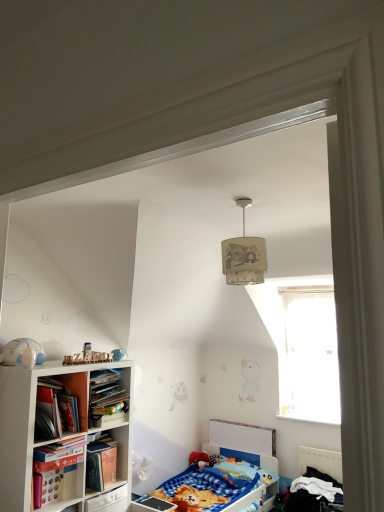
This screenshot has width=384, height=512. I want to click on hardcover book at lower left, positioned as the 2th book in top-to-bottom order, so click(x=57, y=470).

What is the approximate width of blue cotton bed at lower right, placed as the second bed when sorted from left to right?

It is 42.70 centimeters.

What do you see at coordinates (321, 461) in the screenshot? Image resolution: width=384 pixels, height=512 pixels. I see `blue cotton bed at lower right, placed as the second bed when sorted from left to right` at bounding box center [321, 461].

In order to face transparent glass window at upper right, should I rotate leftwards or rightwards?

Turn right approximately 15.132 degrees to face it.

The image size is (384, 512). What do you see at coordinates (58, 405) in the screenshot? I see `hardcover book at left, the 2th book from the bottom` at bounding box center [58, 405].

What do you see at coordinates (227, 473) in the screenshot? This screenshot has height=512, width=384. I see `blue fabric bed at lower center, which appears as the 2th bed when viewed from the right` at bounding box center [227, 473].

I want to click on beige fabric lampshade at upper center, so click(x=244, y=256).

Looking at the image, does beige fabric lampshade at upper center seem bigger or smaller compared to blue fabric bed at lower center, which appears as the 2th bed when viewed from the right?

Considering their sizes, beige fabric lampshade at upper center takes up less space than blue fabric bed at lower center, which appears as the 2th bed when viewed from the right.

Is beige fabric lampshade at upper center located outside blue fabric bed at lower center, which appears as the 2th bed when viewed from the right?

Indeed, beige fabric lampshade at upper center is completely outside blue fabric bed at lower center, which appears as the 2th bed when viewed from the right.

From a real-world perspective, between beige fabric lampshade at upper center and blue fabric bed at lower center, the 1th bed viewed from the left, who is vertically lower?

blue fabric bed at lower center, the 1th bed viewed from the left, from a real-world perspective.

From a real-world perspective, is white matte bookcase at left above or below transparent glass window at upper right?

Clearly, from a real-world perspective, white matte bookcase at left is below transparent glass window at upper right.

Does white matte bookcase at left contain transparent glass window at upper right?

No, transparent glass window at upper right is located outside of white matte bookcase at left.

Can you confirm if white matte bookcase at left is shorter than transparent glass window at upper right?

Yes.

Between white matte bookcase at left and transparent glass window at upper right, which one appears on the left side from the viewer's perspective?

white matte bookcase at left.

Who is more distant, blue cotton bed at lower right, which is counted as the first bed, starting from the right, or transparent glass window at upper right?

transparent glass window at upper right is further away from the camera.

Is blue cotton bed at lower right, which is counted as the first bed, starting from the right, in contact with transparent glass window at upper right?

No, blue cotton bed at lower right, which is counted as the first bed, starting from the right, is not with transparent glass window at upper right.

Looking at their sizes, would you say blue cotton bed at lower right, which is counted as the first bed, starting from the right, is wider or thinner than transparent glass window at upper right?

Clearly, blue cotton bed at lower right, which is counted as the first bed, starting from the right, has more width compared to transparent glass window at upper right.

Considering the sizes of objects blue fabric bed at lower center, the 1th bed viewed from the left, and hardcover book at left, acting as the first book starting from the top, in the image provided, who is wider, blue fabric bed at lower center, the 1th bed viewed from the left, or hardcover book at left, acting as the first book starting from the top,?

blue fabric bed at lower center, the 1th bed viewed from the left, is wider.

Is blue fabric bed at lower center, the 1th bed viewed from the left, not inside hardcover book at left, acting as the first book starting from the top?

Yes, blue fabric bed at lower center, the 1th bed viewed from the left, is not within hardcover book at left, acting as the first book starting from the top.

Does blue fabric bed at lower center, which appears as the 2th bed when viewed from the right, appear on the right side of hardcover book at left, acting as the first book starting from the top?

Indeed, blue fabric bed at lower center, which appears as the 2th bed when viewed from the right, is positioned on the right side of hardcover book at left, acting as the first book starting from the top.

Consider the image. Is hardcover book at left, the 2th book from the bottom, at the back of blue fabric bed at lower center, which appears as the 2th bed when viewed from the right?

That's not correct — blue fabric bed at lower center, which appears as the 2th bed when viewed from the right, is not looking away from hardcover book at left, the 2th book from the bottom.

Is hardcover book at lower left, positioned as the 2th book in top-to-bottom order, looking in the opposite direction of beige fabric lampshade at upper center?

No.

This screenshot has width=384, height=512. What are the coordinates of `lamp on the right side of hardcover book at lower left, positioned as the 2th book in top-to-bottom order` in the screenshot? It's located at coord(244,256).

Do you think hardcover book at lower left, positioned as the 2th book in top-to-bottom order, is within beige fabric lampshade at upper center, or outside of it?

hardcover book at lower left, positioned as the 2th book in top-to-bottom order, is not enclosed by beige fabric lampshade at upper center.

Is hardcover book at lower left, which is the first book from bottom to top, at the right side of beige fabric lampshade at upper center?

In fact, hardcover book at lower left, which is the first book from bottom to top, is to the left of beige fabric lampshade at upper center.

Considering the relative sizes of beige fabric lampshade at upper center and blue cotton bed at lower right, placed as the second bed when sorted from left to right, in the image provided, is beige fabric lampshade at upper center taller than blue cotton bed at lower right, placed as the second bed when sorted from left to right,?

Indeed, beige fabric lampshade at upper center has a greater height compared to blue cotton bed at lower right, placed as the second bed when sorted from left to right.

Is beige fabric lampshade at upper center oriented towards blue cotton bed at lower right, which is counted as the first bed, starting from the right?

No, beige fabric lampshade at upper center is not facing towards blue cotton bed at lower right, which is counted as the first bed, starting from the right.

Considering the points (245, 237) and (337, 472), which point is behind, point (245, 237) or point (337, 472)?

The point (337, 472) is behind.

From a real-world perspective, is beige fabric lampshade at upper center on blue cotton bed at lower right, which is counted as the first bed, starting from the right?

Yes.

In the scene shown: Does transparent glass window at upper right contain hardcover book at left, the 2th book from the bottom?

No, transparent glass window at upper right does not contain hardcover book at left, the 2th book from the bottom.

In the scene shown: From the image's perspective, is transparent glass window at upper right above hardcover book at left, acting as the first book starting from the top?

No, from the image's perspective, transparent glass window at upper right is not over hardcover book at left, acting as the first book starting from the top.

Which object is more forward, transparent glass window at upper right or hardcover book at left, acting as the first book starting from the top?

hardcover book at left, acting as the first book starting from the top, is more forward.

Locate an element on the screen. lamp on the right of blue fabric bed at lower center, the 1th bed viewed from the left is located at coordinates (244, 256).

Locate an element on the screen. bookcase below the transparent glass window at upper right (from the image's perspective) is located at coordinates (55, 440).

Which object lies further to the anchor point beige fabric lampshade at upper center, blue fabric bed at lower center, the 1th bed viewed from the left, or hardcover book at lower left, positioned as the 2th book in top-to-bottom order?

blue fabric bed at lower center, the 1th bed viewed from the left, lies further to beige fabric lampshade at upper center than the other object.

Based on their spatial positions, is white matte bookcase at left or hardcover book at left, acting as the first book starting from the top, further from white matte toy at left?

white matte bookcase at left lies further to white matte toy at left than the other object.

Looking at the image, which one is located closer to transparent glass window at upper right, hardcover book at lower left, positioned as the 2th book in top-to-bottom order, or white matte bookcase at left?

Among the two, white matte bookcase at left is located nearer to transparent glass window at upper right.

Based on their spatial positions, is white matte bookcase at left or transparent glass window at upper right further from blue cotton bed at lower right, placed as the second bed when sorted from left to right?

Answer: white matte bookcase at left.

Considering their positions, is white matte toy at left positioned closer to hardcover book at lower left, which is the first book from bottom to top, than beige fabric lampshade at upper center?

white matte toy at left is positioned closer to the anchor hardcover book at lower left, which is the first book from bottom to top.

When comparing their distances from white matte toy at left, does transparent glass window at upper right or hardcover book at left, acting as the first book starting from the top, seem further?

Based on the image, transparent glass window at upper right appears to be further to white matte toy at left.

From the image, which object appears to be nearer to hardcover book at left, the 2th book from the bottom, hardcover book at lower left, which is the first book from bottom to top, or blue fabric bed at lower center, the 1th bed viewed from the left?

Among the two, hardcover book at lower left, which is the first book from bottom to top, is located nearer to hardcover book at left, the 2th book from the bottom.

Estimate the real-world distances between objects in this image. Which object is closer to blue fabric bed at lower center, the 1th bed viewed from the left, white matte bookcase at left or hardcover book at left, acting as the first book starting from the top?

Among the two, white matte bookcase at left is located nearer to blue fabric bed at lower center, the 1th bed viewed from the left.

Find the location of a particular element. book situated between hardcover book at left, the 2th book from the bottom, and transparent glass window at upper right from left to right is located at coordinates (57, 470).

Locate an element on the screen. The height and width of the screenshot is (512, 384). book between white matte toy at left and hardcover book at lower left, positioned as the 2th book in top-to-bottom order, in the up-down direction is located at coordinates (58, 405).

Locate an element on the screen. This screenshot has height=512, width=384. book between beige fabric lampshade at upper center and white matte bookcase at left in the up-down direction is located at coordinates (58, 405).

I want to click on bed between hardcover book at lower left, which is the first book from bottom to top, and blue cotton bed at lower right, placed as the second bed when sorted from left to right, in the horizontal direction, so click(227, 473).